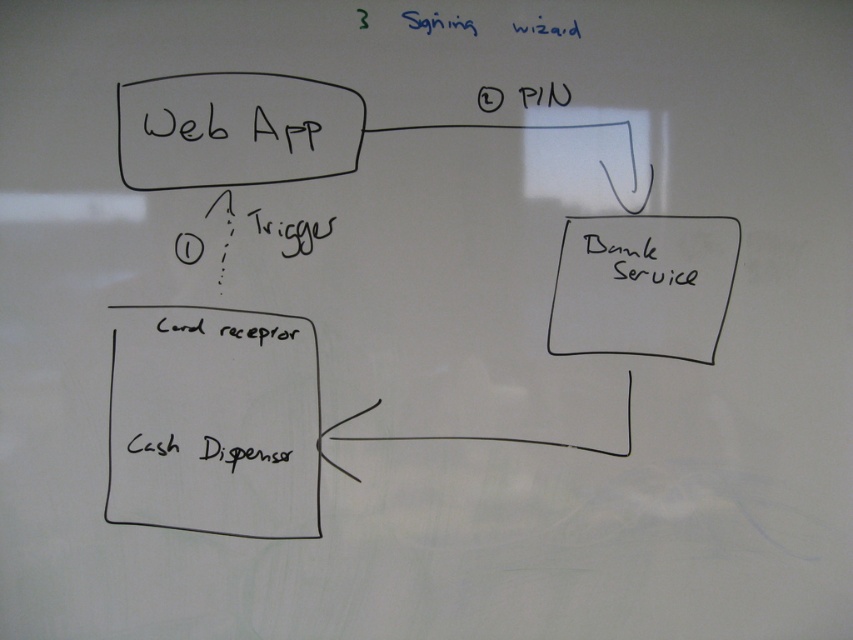
The height and width of the screenshot is (640, 853). What do you see at coordinates (643, 285) in the screenshot?
I see `black paper at upper right` at bounding box center [643, 285].

Who is shorter, black paper at upper right or black handwritten text at center right?

Standing shorter between the two is black handwritten text at center right.

Is point (560, 330) closer to viewer compared to point (675, 262)?

That is False.

Where is `black paper at upper right`? The height and width of the screenshot is (640, 853). black paper at upper right is located at coordinates (643, 285).